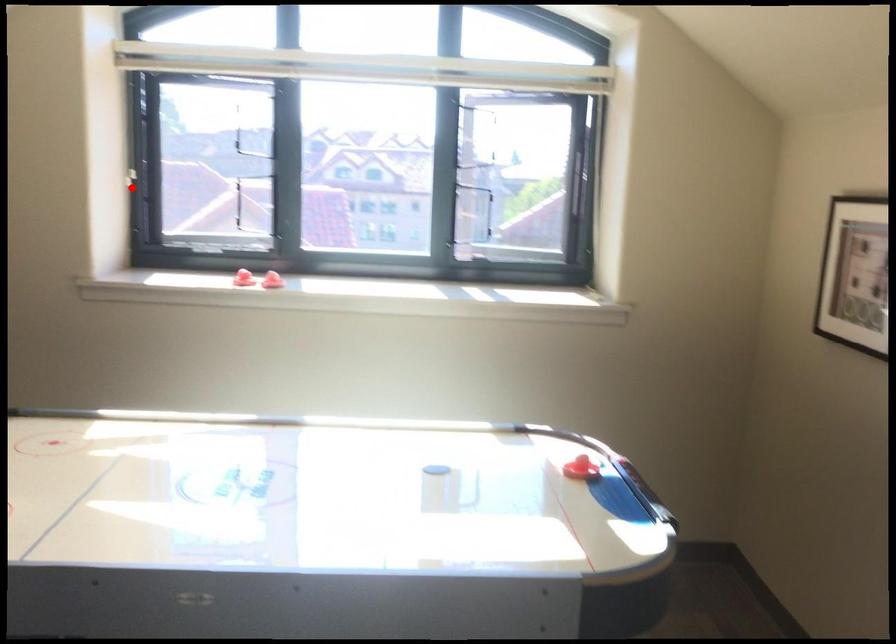
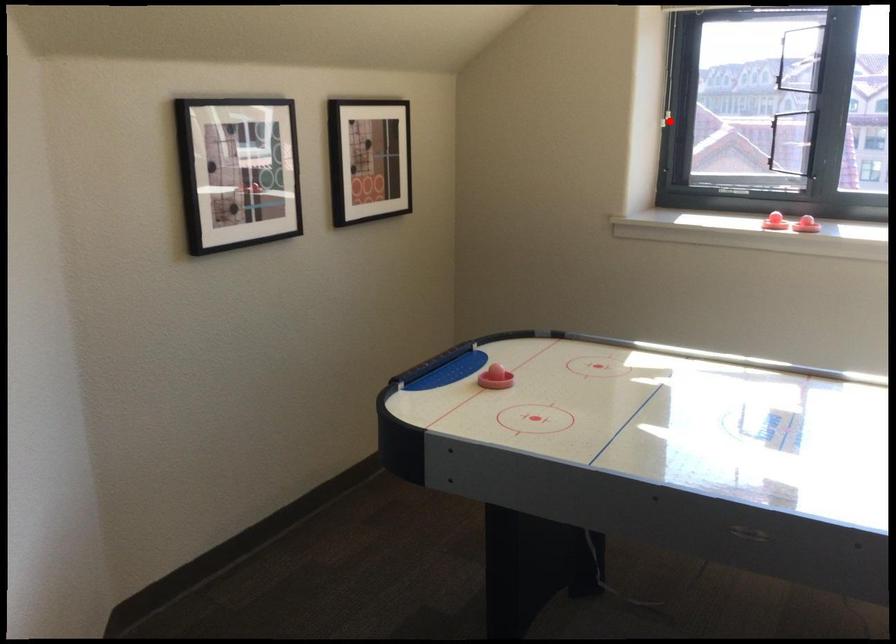
I am providing you with two images of the same scene from different viewpoints. A red point is marked on the first image and another point is marked on the second image. Is the red point in image1 aligned with the point shown in image2?

Yes